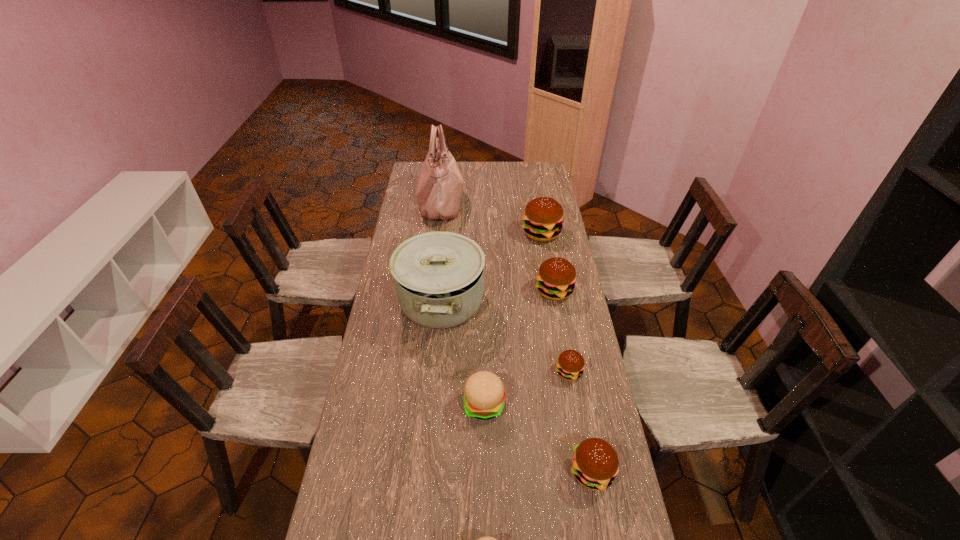
Identify the location of the tallest object. The image size is (960, 540). (440, 185).

Locate an element on the screen. the second tallest object is located at coordinates (439, 276).

This screenshot has height=540, width=960. In order to click on saucepan in this screenshot , I will do `click(439, 276)`.

This screenshot has width=960, height=540. What are the coordinates of `the farthest brown hamburger` in the screenshot? It's located at (543, 217).

Find the location of a particular element. This screenshot has width=960, height=540. the farthest hamburger is located at coordinates (543, 217).

Where is `the fourth tallest object`? the fourth tallest object is located at coordinates (x=556, y=278).

Locate an element on the screen. The height and width of the screenshot is (540, 960). the fifth shortest hamburger is located at coordinates (556, 278).

Image resolution: width=960 pixels, height=540 pixels. In order to click on the seventh farthest object in this screenshot , I will do `click(595, 464)`.

You are a GUI agent. You are given a task and a screenshot of the screen. Output one action in this format:
    pyautogui.click(x=<x>, y=<y>)
    Task: Click on the second nearest hamburger
    Image resolution: width=960 pixels, height=540 pixels.
    Given the screenshot: What is the action you would take?
    pyautogui.click(x=595, y=464)

Where is `the bigger beige hamburger`? the bigger beige hamburger is located at coordinates (484, 393).